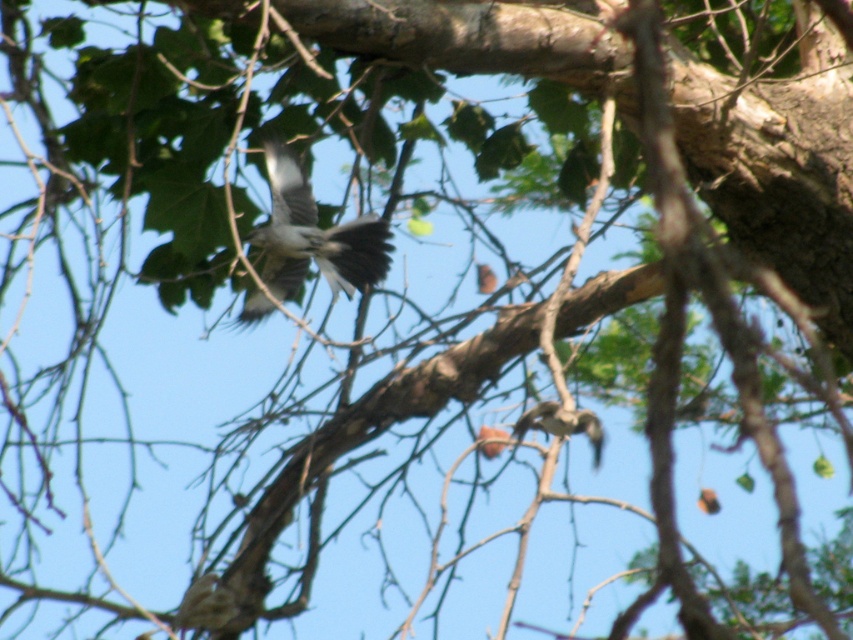
Can you confirm if gray feathered bird at center is shorter than brown speckled feather at lower right?

No, gray feathered bird at center is not shorter than brown speckled feather at lower right.

Can you confirm if gray feathered bird at center is thinner than brown speckled feather at lower right?

No, gray feathered bird at center is not thinner than brown speckled feather at lower right.

At what (x,y) coordinates should I click in order to perform the action: click on gray feathered bird at center. Please return your answer as a coordinate pair (x, y). The width and height of the screenshot is (853, 640). Looking at the image, I should click on (312, 236).